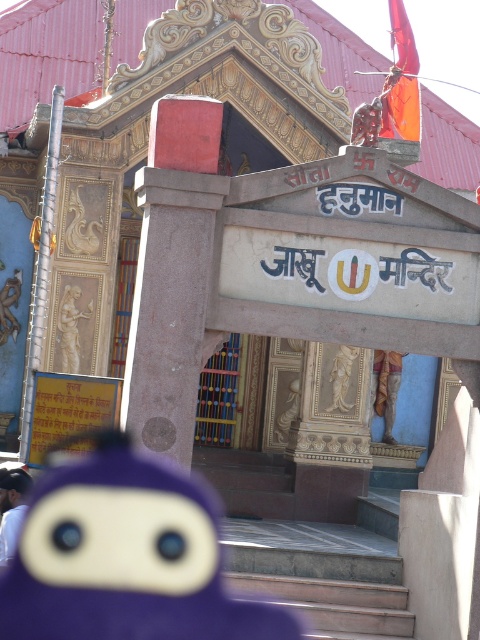
Question: Is purple plush toy at center closer to the viewer compared to carved stone statue at center?

Choices:
 (A) no
 (B) yes

Answer: (B)

Question: Considering the real-world distances, which object is closest to the carved stone statue at center?

Choices:
 (A) blue fabric cap at lower left
 (B) purple plush toy at center
 (C) smooth stone statue at center

Answer: (C)

Question: Which point is farther from the camera taking this photo?

Choices:
 (A) (0, 548)
 (B) (384, 397)
 (C) (72, 332)

Answer: (B)

Question: Based on their relative distances, which object is nearer to the blue fabric cap at lower left?

Choices:
 (A) carved stone statue at center
 (B) smooth stone statue at center
 (C) purple plush toy at center

Answer: (C)

Question: Is blue fabric cap at lower left to the right of carved stone statue at center from the viewer's perspective?

Choices:
 (A) no
 (B) yes

Answer: (A)

Question: Where is purple plush toy at center located in relation to blue fabric cap at lower left in the image?

Choices:
 (A) below
 (B) above

Answer: (A)